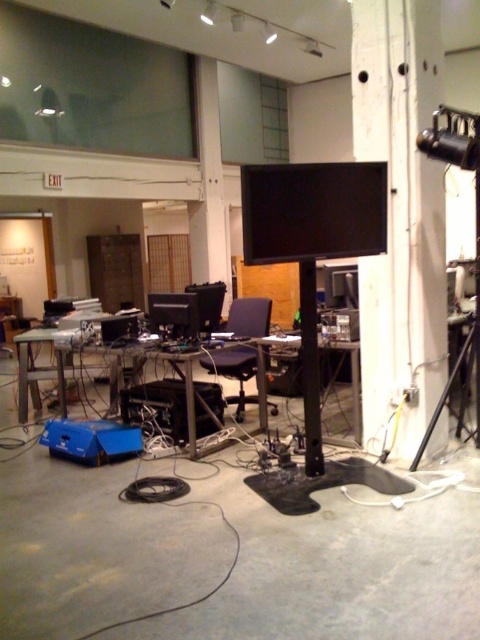
Does point (113, 408) lie behind point (465, 356)?

Yes, point (113, 408) is farther from viewer.

Does metallic gray table at center have a smaller size compared to black matte tripod at right?

No.

The height and width of the screenshot is (640, 480). What do you see at coordinates (32, 369) in the screenshot?
I see `metallic gray table at center` at bounding box center [32, 369].

What are the coordinates of `metallic gray table at center` in the screenshot? It's located at (32, 369).

Locate an element on the screen. The width and height of the screenshot is (480, 640). wooden pillar at center-right is located at coordinates (400, 218).

Does wooden pillar at center-right lie in front of black plastic swivel chair at center?

Yes, wooden pillar at center-right is in front of black plastic swivel chair at center.

Is point (393, 67) farther from viewer compared to point (269, 404)?

That is False.

At what (x,y) coordinates should I click in order to perform the action: click on wooden pillar at center-right. Please return your answer as a coordinate pair (x, y). Looking at the image, I should click on (400, 218).

Does metallic gray table at center appear on the left side of black plastic swivel chair at center?

Indeed, metallic gray table at center is positioned on the left side of black plastic swivel chair at center.

The height and width of the screenshot is (640, 480). What do you see at coordinates (32, 369) in the screenshot? I see `metallic gray table at center` at bounding box center [32, 369].

Identify the location of metallic gray table at center. (32, 369).